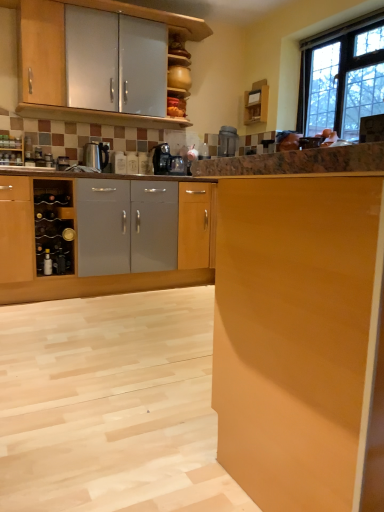
Question: Should I look upward or downward to see metallic silver wine rack at left, positioned as the first appliance in bottom-to-top order?

Choices:
 (A) up
 (B) down

Answer: (A)

Question: Considering the relative sizes of matte wood cabinet at right, the 3th cabinetry when ordered from back to front, and metallic silver bottle at lower left in the image provided, is matte wood cabinet at right, the 3th cabinetry when ordered from back to front, smaller than metallic silver bottle at lower left?

Choices:
 (A) yes
 (B) no

Answer: (B)

Question: Is matte wood cabinet at right, which ranks as the second cabinetry in bottom-to-top order, beside metallic silver bottle at lower left?

Choices:
 (A) yes
 (B) no

Answer: (B)

Question: Does matte wood cabinet at right, which is counted as the 1th cabinetry, starting from the front, lie behind metallic silver bottle at lower left?

Choices:
 (A) yes
 (B) no

Answer: (B)

Question: Is matte wood cabinet at right, which ranks as the second cabinetry in bottom-to-top order, positioned beyond the bounds of metallic silver bottle at lower left?

Choices:
 (A) yes
 (B) no

Answer: (A)

Question: Would you say metallic silver bottle at lower left is part of matte wood cabinet at right, which ranks as the second cabinetry in bottom-to-top order,'s contents?

Choices:
 (A) yes
 (B) no

Answer: (B)

Question: From a real-world perspective, is matte wood cabinet at right, the 3th cabinetry when ordered from back to front, physically below metallic silver bottle at lower left?

Choices:
 (A) no
 (B) yes

Answer: (A)

Question: Considering the relative sizes of metallic silver toaster at upper center, which is the second appliance in front-to-back order, and black plastic coffee machine at center in the image provided, is metallic silver toaster at upper center, which is the second appliance in front-to-back order, shorter than black plastic coffee machine at center?

Choices:
 (A) no
 (B) yes

Answer: (A)

Question: Does metallic silver toaster at upper center, which is the second appliance in front-to-back order, lie behind black plastic coffee machine at center?

Choices:
 (A) no
 (B) yes

Answer: (B)

Question: Can you confirm if metallic silver toaster at upper center, the 1th appliance positioned from the right, is smaller than black plastic coffee machine at center?

Choices:
 (A) yes
 (B) no

Answer: (A)

Question: Is black plastic coffee machine at center at the back of metallic silver toaster at upper center, the second appliance when ordered from left to right?

Choices:
 (A) no
 (B) yes

Answer: (A)

Question: From a real-world perspective, is metallic silver toaster at upper center, the 1th appliance positioned from the right, physically above black plastic coffee machine at center?

Choices:
 (A) no
 (B) yes

Answer: (B)

Question: Is black plastic coffee machine at center surrounded by metallic silver toaster at upper center, the 1th appliance positioned from the right?

Choices:
 (A) yes
 (B) no

Answer: (B)

Question: Could you tell me if wooden wine rack at left is turned towards metallic silver wine rack at left, positioned as the first appliance in bottom-to-top order?

Choices:
 (A) yes
 (B) no

Answer: (B)